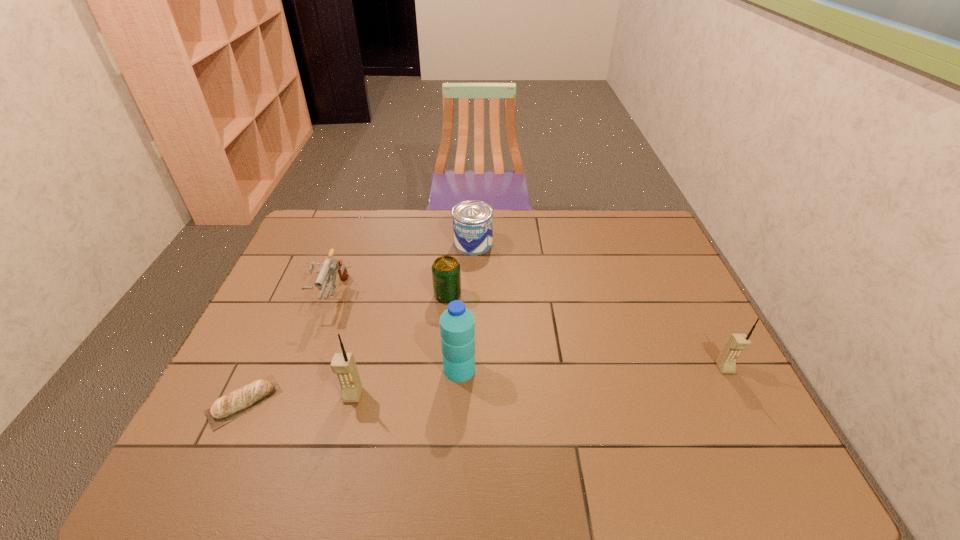
Locate an element on the screen. The height and width of the screenshot is (540, 960). free area in between the farthest object and the gun is located at coordinates tap(402, 269).

Find the location of a particular element. This screenshot has width=960, height=540. vacant point located between the pita bread and the third object from left to right is located at coordinates (299, 399).

Locate an element on the screen. vacant space that's between the left cellular telephone and the water bottle is located at coordinates (406, 382).

Image resolution: width=960 pixels, height=540 pixels. Identify the location of vacant region between the beer can and the shortest object. (346, 348).

Find the location of `vacant region between the gun and the beer can`. vacant region between the gun and the beer can is located at coordinates (390, 295).

I want to click on the third closest object to the rightmost object, so click(x=472, y=220).

Identify which object is located as the sixth nearest to the gun. Please provide its 2D coordinates. Your answer should be formatted as a tuple, i.e. [(x, y)], where the tuple contains the x and y coordinates of a point satisfying the conditions above.

[(726, 361)]

Identify the location of free location that satisfies the following two spatial constraints: 1. at the barrel end of the gun; 2. on the left side of the water bottle. click(x=305, y=369).

At what (x,y) coordinates should I click in order to perform the action: click on vacant point that satisfies the following two spatial constraints: 1. at the barrel end of the gun; 2. on the left side of the water bottle. Please return your answer as a coordinate pair (x, y). The height and width of the screenshot is (540, 960). Looking at the image, I should click on (305, 369).